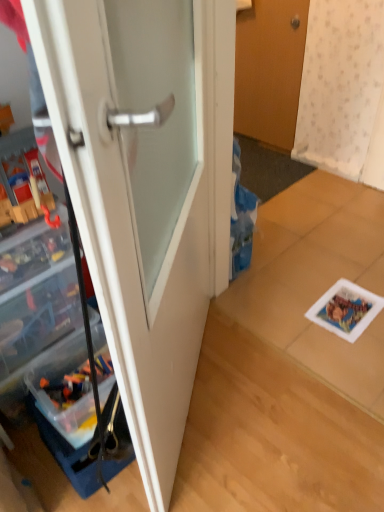
Question: Is wooden door at upper center, the 1th door when ordered from top to bottom, inside the boundaries of white glossy door at center, the 1th door when ordered from bottom to top, or outside?

Choices:
 (A) outside
 (B) inside

Answer: (A)

Question: Looking at their shapes, would you say wooden door at upper center, positioned as the 1th door in back-to-front order, is wider or thinner than white glossy door at center, the 2th door from the top?

Choices:
 (A) thin
 (B) wide

Answer: (A)

Question: Which object is positioned closest to the wooden door at upper center, which is the second door from front to back?

Choices:
 (A) clear plastic cabinet at left
 (B) white glossy door at center, marked as the second door in a right-to-left arrangement

Answer: (B)

Question: Which object is the closest to the clear plastic cabinet at left?

Choices:
 (A) white glossy door at center, placed as the 2th door when sorted from back to front
 (B) wooden door at upper center, which is the second door from front to back

Answer: (A)